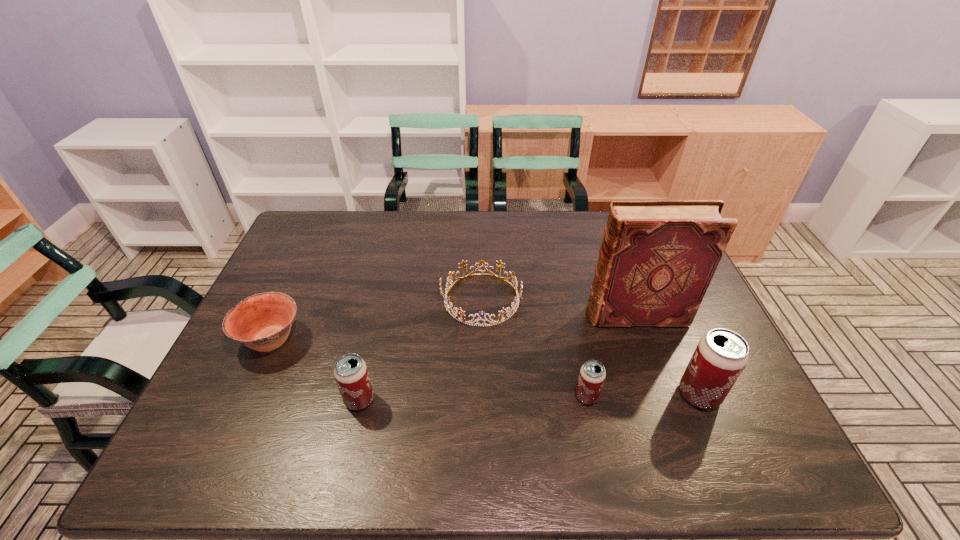
I want to click on empty location between the bowl and the fourth shortest object, so click(316, 369).

This screenshot has width=960, height=540. Identify the location of unoccupied position between the tallest beer can and the leftmost beer can. (529, 397).

Identify the location of free space between the shortest object and the second object from left to right. This screenshot has height=540, width=960. (420, 349).

Identify the location of vacant space that is in between the shortest beer can and the fourth object from right to left. (534, 348).

Where is `blank region between the third object from right to left and the leftmost object`? The height and width of the screenshot is (540, 960). blank region between the third object from right to left and the leftmost object is located at coordinates (429, 368).

The image size is (960, 540). I want to click on vacant space that is in between the fourth object from left to right and the fourth shortest object, so click(473, 398).

Locate an element on the screen. vacant region between the second shortest beer can and the shortest object is located at coordinates (420, 349).

The image size is (960, 540). What are the coordinates of `blank region between the shortest beer can and the leftmost object` in the screenshot? It's located at point(429,368).

Identify which object is located as the third nearest to the second beer can from left to right. Please provide its 2D coordinates. Your answer should be formatted as a tuple, i.e. [(x, y)], where the tuple contains the x and y coordinates of a point satisfying the conditions above.

[(514, 306)]

I want to click on the third closest object relative to the third object from left to right, so click(351, 374).